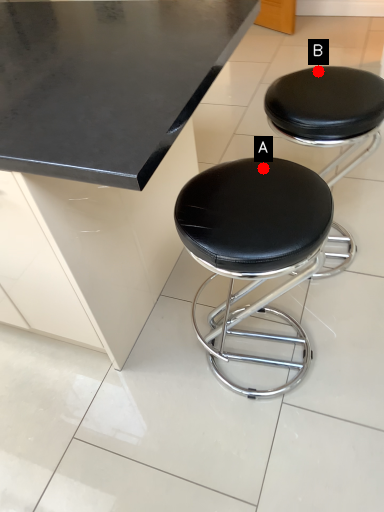
Question: Two points are circled on the image, labeled by A and B beside each circle. Which point is further to the camera?

Choices:
 (A) A is further
 (B) B is further

Answer: (B)